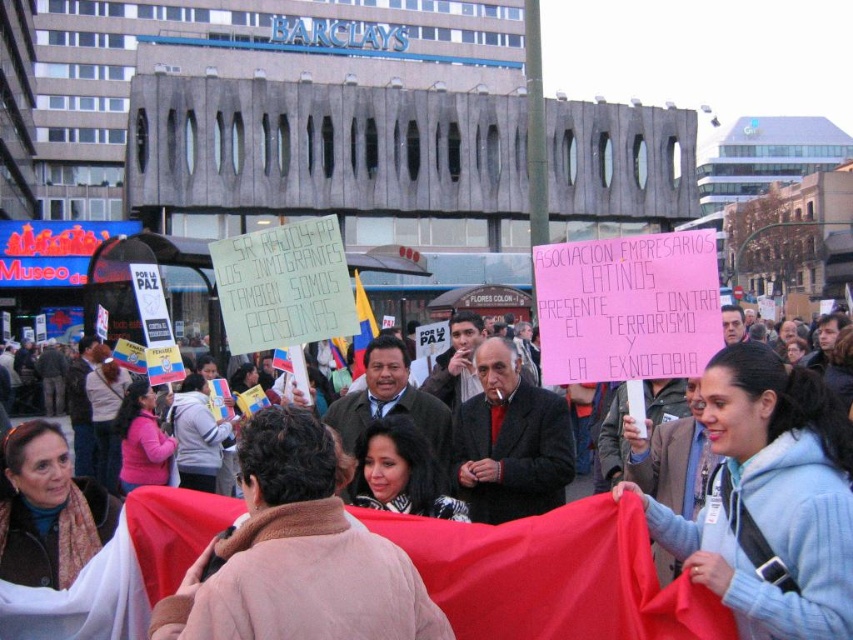
Question: Which of the following is the closest to the observer?

Choices:
 (A) smooth black hair at center
 (B) matte pink scarf at center
 (C) light blue fleece jacket at lower right
 (D) pink fleece jacket at lower left

Answer: (C)

Question: Which point is farther to the camera?

Choices:
 (A) light blue fleece jacket at lower right
 (B) matte pink scarf at center

Answer: (B)

Question: Among these objects, which one is farthest from the camera?

Choices:
 (A) matte pink scarf at center
 (B) light blue fleece jacket at lower right

Answer: (A)

Question: Does smooth black hair at center appear over matte pink scarf at center?

Choices:
 (A) no
 (B) yes

Answer: (A)

Question: Where is light blue fleece jacket at lower right located in relation to pink fleece jacket at lower left in the image?

Choices:
 (A) right
 (B) left

Answer: (A)

Question: Is light blue fleece jacket at lower right in front of pink fleece jacket at lower left?

Choices:
 (A) no
 (B) yes

Answer: (B)